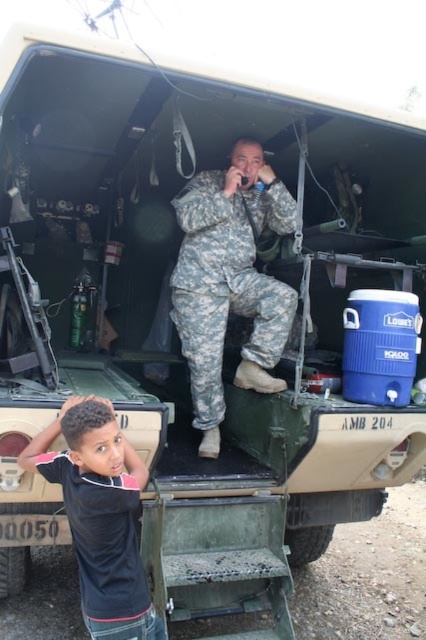
Question: Which point appears farthest from the camera in this image?

Choices:
 (A) (134, 579)
 (B) (206, 259)

Answer: (B)

Question: Is camouflage fabric uniform at center smaller than black matte shirt at lower left?

Choices:
 (A) no
 (B) yes

Answer: (A)

Question: Is camouflage fabric uniform at center smaller than black matte shirt at lower left?

Choices:
 (A) no
 (B) yes

Answer: (A)

Question: Which object is closer to the camera taking this photo?

Choices:
 (A) camouflage fabric uniform at center
 (B) black matte shirt at lower left

Answer: (B)

Question: Is camouflage fabric uniform at center smaller than black matte shirt at lower left?

Choices:
 (A) yes
 (B) no

Answer: (B)